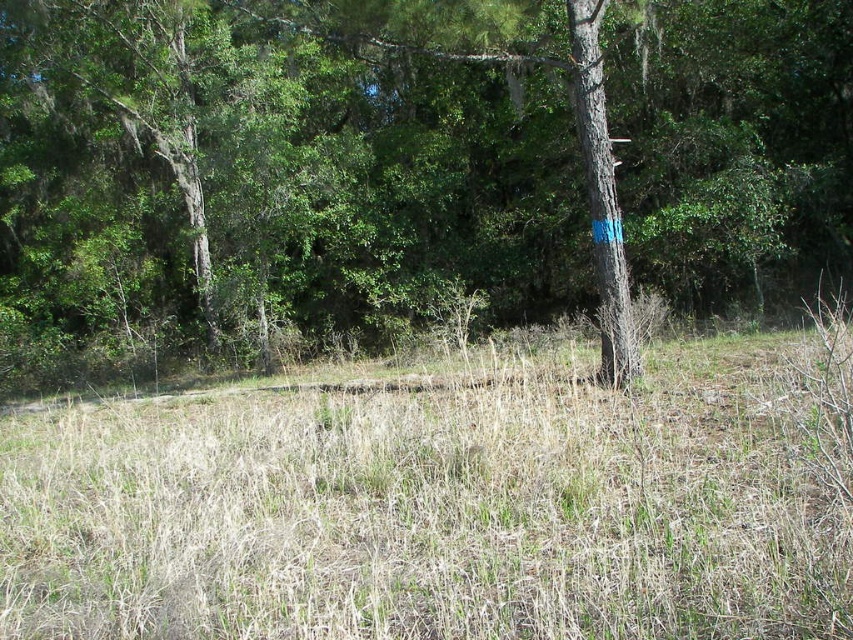
Between green rough bark tree at center and dry grass at center, which one appears on the left side from the viewer's perspective?

From the viewer's perspective, green rough bark tree at center appears more on the left side.

Find the location of `green rough bark tree at center`. green rough bark tree at center is located at coordinates (413, 163).